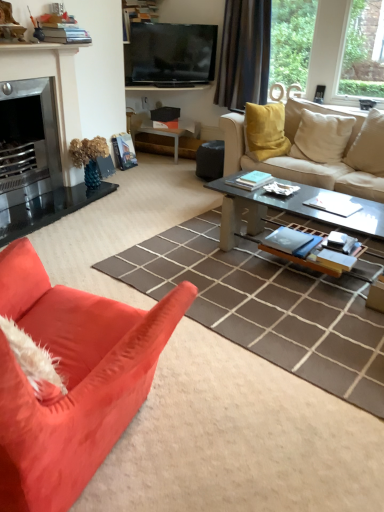
Question: From a real-world perspective, is flat screen tv at upper center located higher than matte white side table at center?

Choices:
 (A) no
 (B) yes

Answer: (B)

Question: Is the depth of flat screen tv at upper center greater than that of matte white side table at center?

Choices:
 (A) no
 (B) yes

Answer: (A)

Question: Considering the relative sizes of flat screen tv at upper center and matte white side table at center in the image provided, is flat screen tv at upper center wider than matte white side table at center?

Choices:
 (A) no
 (B) yes

Answer: (A)

Question: Can you confirm if flat screen tv at upper center is bigger than matte white side table at center?

Choices:
 (A) no
 (B) yes

Answer: (A)

Question: Does flat screen tv at upper center come in front of matte white side table at center?

Choices:
 (A) no
 (B) yes

Answer: (B)

Question: In terms of size, does beige fabric pillow at right, the 2th pillow from the right, appear bigger or smaller than clear glass coffee table at center?

Choices:
 (A) big
 (B) small

Answer: (B)

Question: Which is correct: beige fabric pillow at right, the 2th pillow from the right, is inside clear glass coffee table at center, or outside of it?

Choices:
 (A) outside
 (B) inside

Answer: (A)

Question: Considering their positions, is beige fabric pillow at right, the 2th pillow from the right, located in front of or behind clear glass coffee table at center?

Choices:
 (A) front
 (B) behind

Answer: (B)

Question: From the image's perspective, relative to clear glass coffee table at center, is beige fabric pillow at right, positioned as the 1th pillow in left-to-right order, above or below?

Choices:
 (A) below
 (B) above

Answer: (B)

Question: From a real-world perspective, relative to beige fabric couch at upper right, the first studio couch in the back-to-front sequence, is flat screen tv at upper center vertically above or below?

Choices:
 (A) above
 (B) below

Answer: (A)

Question: Does point (213, 47) appear closer or farther from the camera than point (362, 131)?

Choices:
 (A) farther
 (B) closer

Answer: (A)

Question: Is flat screen tv at upper center taller or shorter than beige fabric couch at upper right, arranged as the 2th studio couch when ordered from the bottom?

Choices:
 (A) tall
 (B) short

Answer: (B)

Question: From the image's perspective, relative to beige fabric couch at upper right, acting as the 1th studio couch starting from the right, is flat screen tv at upper center above or below?

Choices:
 (A) below
 (B) above

Answer: (B)

Question: From a real-world perspective, relative to beige fabric pillow at upper right, the 1th pillow viewed from the right, is black fabric curtain at upper center vertically above or below?

Choices:
 (A) below
 (B) above

Answer: (B)

Question: Based on their positions, is black fabric curtain at upper center located to the left or right of beige fabric pillow at upper right, positioned as the second pillow in left-to-right order?

Choices:
 (A) right
 (B) left

Answer: (B)